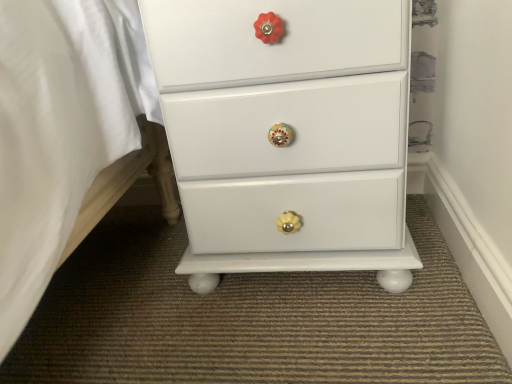
The height and width of the screenshot is (384, 512). Find the location of `white glossy chest of drawers at center`. white glossy chest of drawers at center is located at coordinates (287, 134).

In order to face white glossy chest of drawers at center, should I rotate leftwards or rightwards?

Turn right approximately 4.863 degrees to face it.

This screenshot has height=384, width=512. What do you see at coordinates (287, 134) in the screenshot?
I see `white glossy chest of drawers at center` at bounding box center [287, 134].

Locate an element on the screen. The image size is (512, 384). white glossy chest of drawers at center is located at coordinates (287, 134).